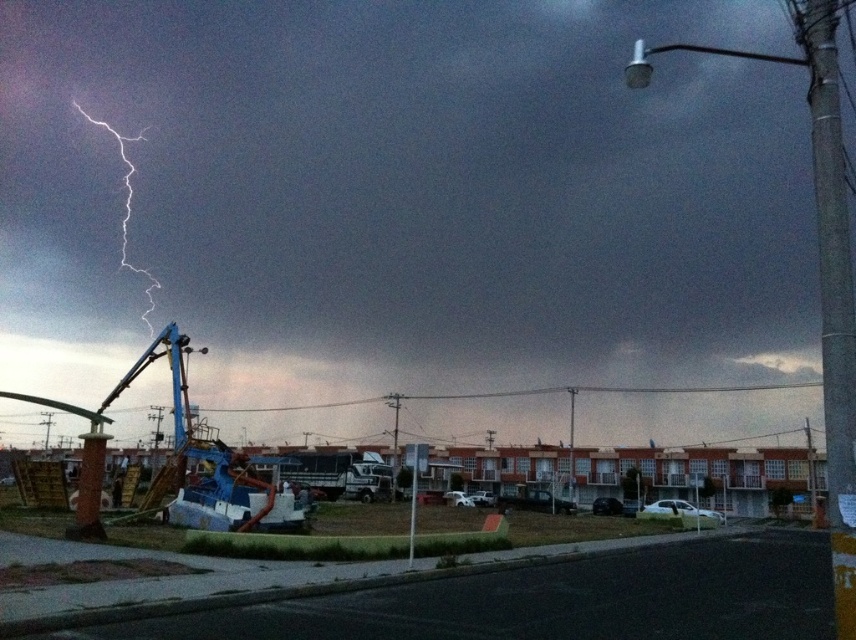
You are a photographer trying to capture the metallic lightning bolt at upper left and the metallic pole at center in your shot. Which object should you focus on if you want to capture the larger one?

The metallic lightning bolt at upper left is bigger than the metallic pole at center, so you should focus on the metallic lightning bolt at upper left to capture the larger one.

You are a city planner analyzing the layout of this street. You need to determine the exact coordinates of the metallic lightning bolt at upper left for safety planning. What are its coordinates?

The metallic lightning bolt at upper left is located at coordinates point [402,196].

You are a pedestrian standing on the sidewalk and see the metallic lightning bolt at upper left and the metallic pole at center. Which object is nearer to you?

The metallic lightning bolt at upper left is closer to the viewer than the metallic pole at center.